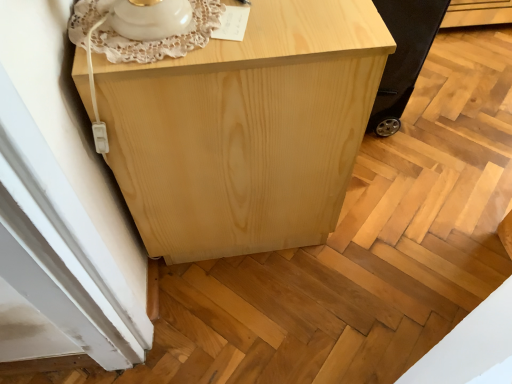
The width and height of the screenshot is (512, 384). In order to click on free location in front of natural wood cabinet at center in this screenshot , I will do `click(279, 309)`.